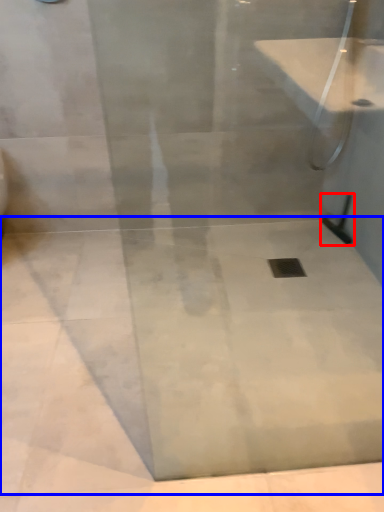
Question: Which object appears closest to the camera in this image, shower (highlighted by a red box) or concrete (highlighted by a blue box)?

Choices:
 (A) shower
 (B) concrete

Answer: (B)